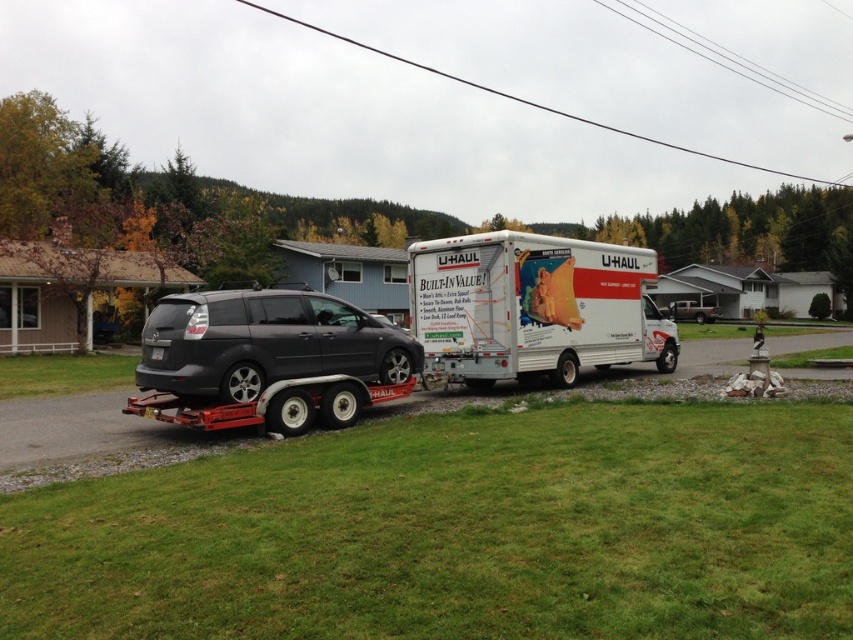
Question: Can you confirm if white matte u-haul trailer at center is positioned to the right of matte gray minivan at center?

Choices:
 (A) yes
 (B) no

Answer: (A)

Question: Which point appears closest to the camera in this image?

Choices:
 (A) (270, 355)
 (B) (525, 282)

Answer: (A)

Question: Does white matte u-haul trailer at center have a smaller size compared to matte gray minivan at center?

Choices:
 (A) no
 (B) yes

Answer: (A)

Question: Is white matte u-haul trailer at center above matte gray minivan at center?

Choices:
 (A) yes
 (B) no

Answer: (A)

Question: Which of the following is the closest to the observer?

Choices:
 (A) matte gray minivan at center
 (B) white matte u-haul trailer at center

Answer: (A)